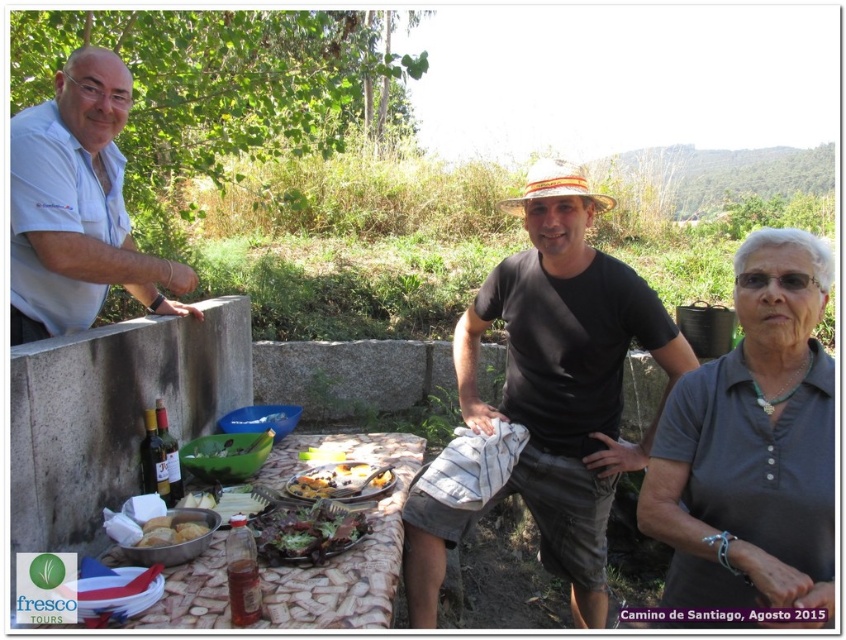
Question: Is white cotton shirt at left below green leafy salad at center?

Choices:
 (A) no
 (B) yes

Answer: (A)

Question: Is black cotton shirt at center below green leafy salad at center?

Choices:
 (A) yes
 (B) no

Answer: (B)

Question: Which is farther from the white cotton shirt at left?

Choices:
 (A) golden brown crusty bread at center
 (B) brown mosaic table at center

Answer: (B)

Question: Among these points, which one is nearest to the camera?

Choices:
 (A) (199, 529)
 (B) (212, 541)

Answer: (A)

Question: In this image, where is gray cotton shirt at lower right located relative to green leafy salad at center?

Choices:
 (A) below
 (B) above

Answer: (B)

Question: Which object is positioned closest to the golden crusty bread at lower left?

Choices:
 (A) white cotton shirt at left
 (B) green leafy salad at center
 (C) golden brown crusty bread at center

Answer: (B)